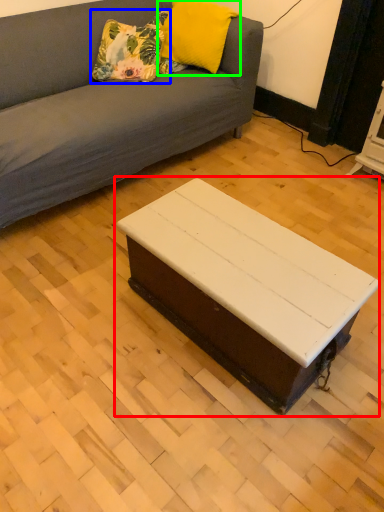
Question: Considering the real-world distances, which object is farthest from coffee table (highlighted by a red box)? pillow (highlighted by a blue box) or pillow (highlighted by a green box)?

Choices:
 (A) pillow
 (B) pillow

Answer: (B)